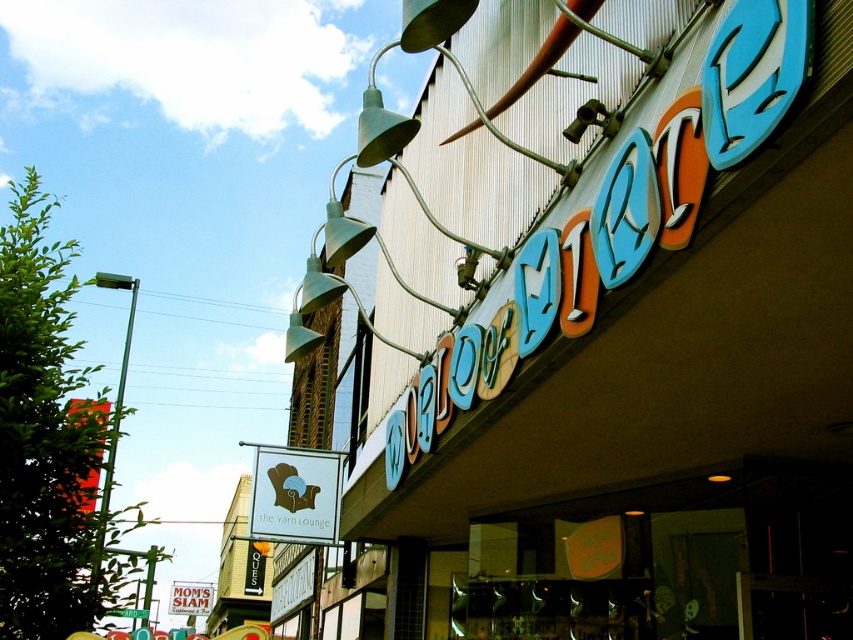
Does point (627, 420) lie in front of point (186, 582)?

Yes, it is in front of point (186, 582).

Is metallic signboard at upper center to the left of white plastic sign at upper center from the viewer's perspective?

In fact, metallic signboard at upper center is to the right of white plastic sign at upper center.

Is point (640, 579) farther from camera compared to point (173, 609)?

No, it is not.

Image resolution: width=853 pixels, height=640 pixels. I want to click on metallic signboard at upper center, so click(633, 353).

Is metallic signboard at upper center to the left of matte white sign at center from the viewer's perspective?

Incorrect, metallic signboard at upper center is not on the left side of matte white sign at center.

Measure the distance between metallic signboard at upper center and matte white sign at center.

They are 14.93 feet apart.

Is point (579, 544) closer to camera compared to point (337, 481)?

Yes, it is.

This screenshot has height=640, width=853. What are the coordinates of `metallic signboard at upper center` in the screenshot? It's located at (633, 353).

Between matte white sign at center and white plastic sign at upper center, which one is positioned lower?

Positioned lower is white plastic sign at upper center.

Who is more forward, [306,541] or [186,612]?

Point [306,541] is in front.

Is point (277, 448) closer to viewer compared to point (201, 582)?

Yes, it is in front of point (201, 582).

This screenshot has height=640, width=853. What are the coordinates of `matte white sign at center` in the screenshot? It's located at click(294, 493).